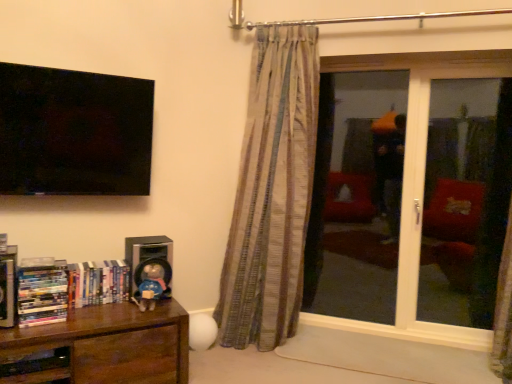
Identify the location of free space in front of satin black speaker at lower left. (131, 304).